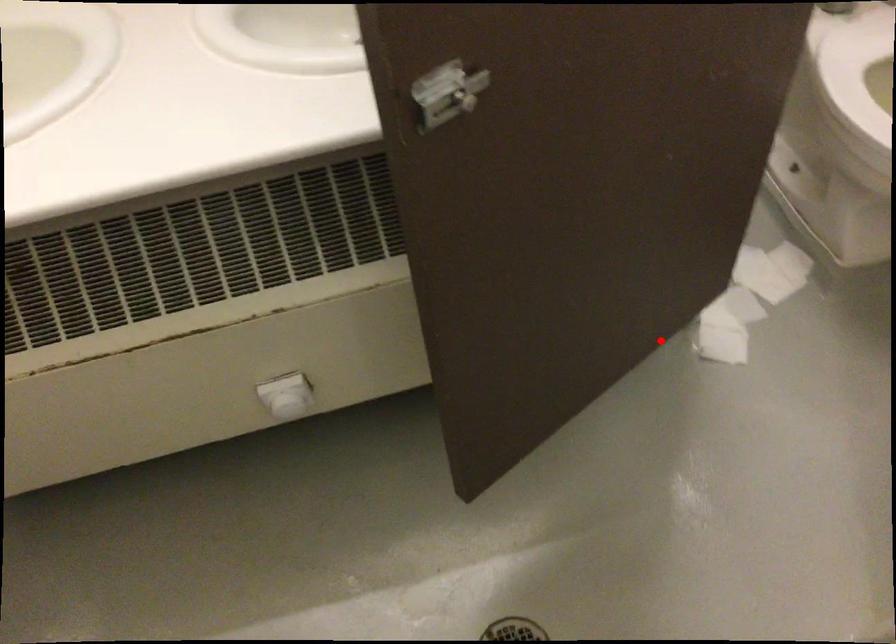
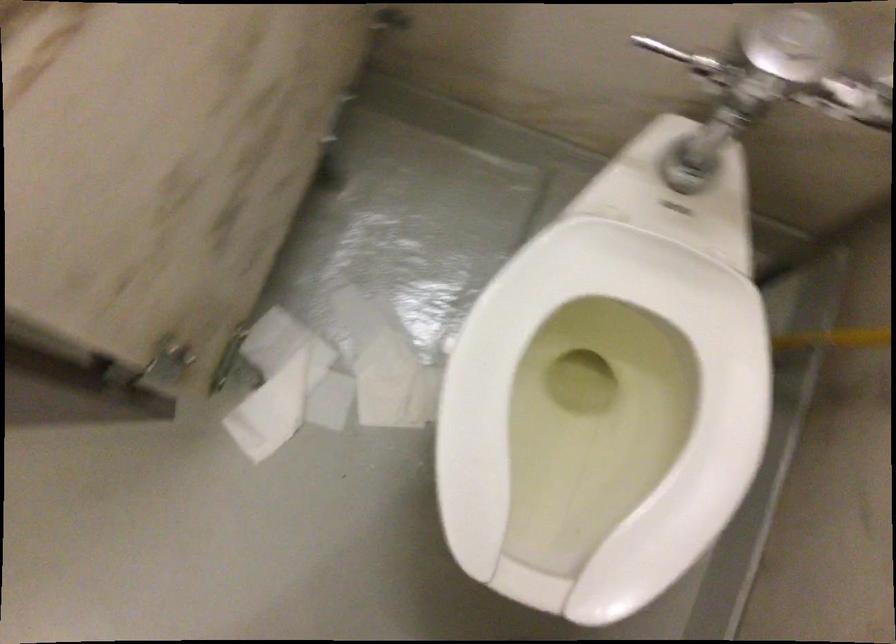
Question: I am providing you with two images of the same scene from different viewpoints. In image1, a red point is highlighted. Considering the same 3D point in image2, which of the following is correct?

Choices:
 (A) It is closer
 (B) It is farther

Answer: (A)